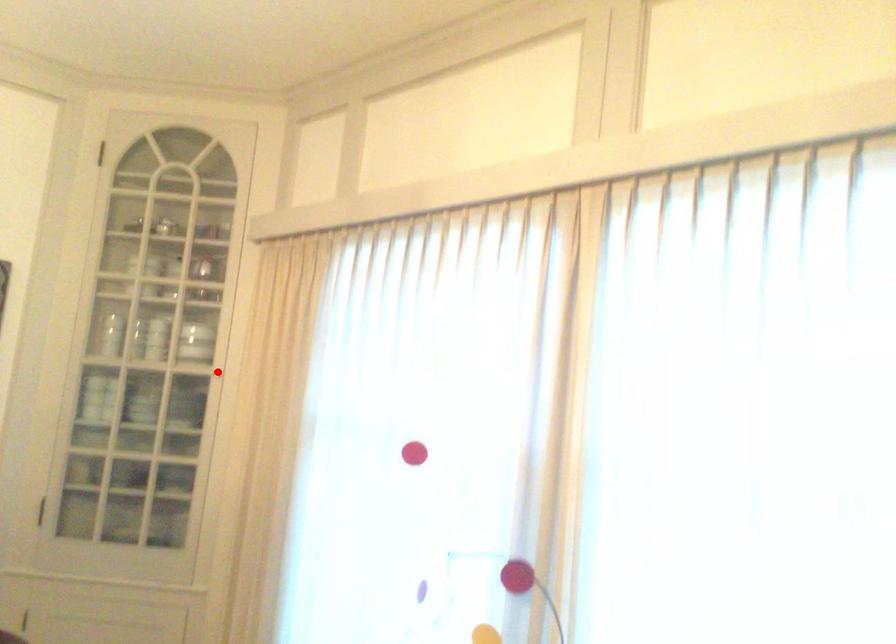
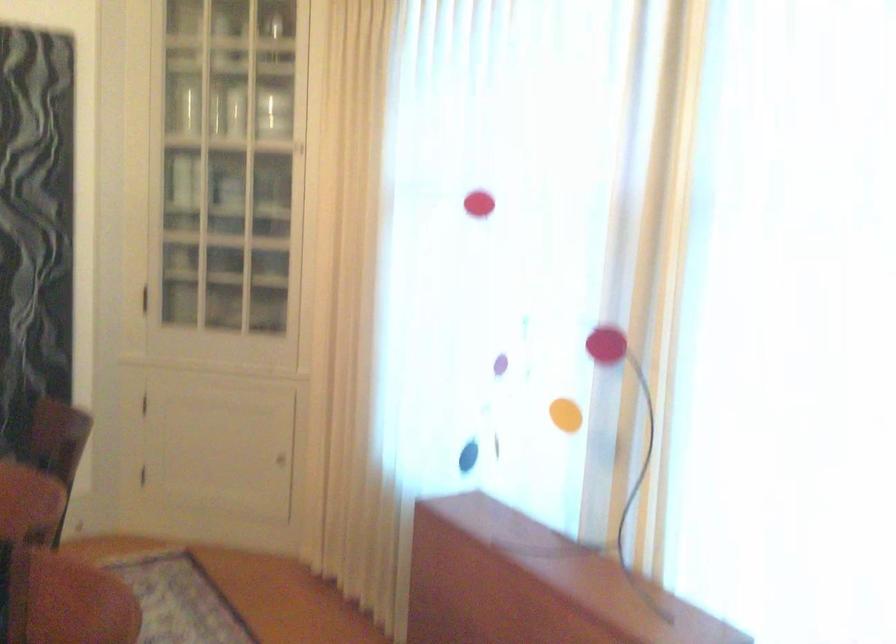
Locate, in the second image, the point that corresponds to the highlighted location in the first image.

(298, 147)